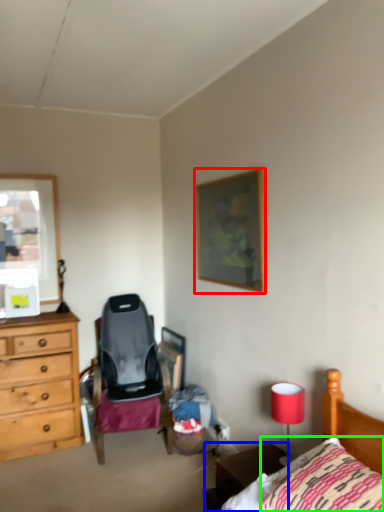
Question: Estimate the real-world distances between objects in this image. Which object is farther from picture frame (highlighted by a red box), nightstand (highlighted by a blue box) or pillow (highlighted by a green box)?

Choices:
 (A) nightstand
 (B) pillow

Answer: (B)